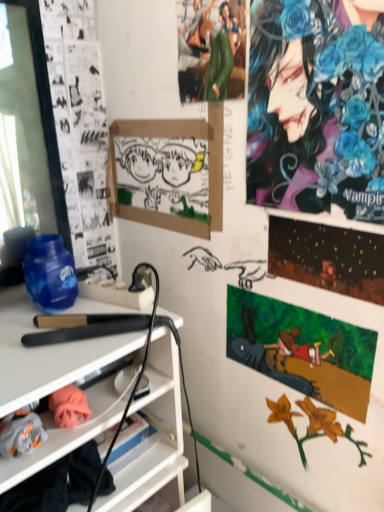
Question: In terms of size, does shiny metallic poster at upper right, which is the 2th poster page in bottom-to-top order, appear bigger or smaller than green fabric figure at upper center, the 1th person when ordered from left to right?

Choices:
 (A) big
 (B) small

Answer: (B)

Question: Is shiny metallic poster at upper right, which is the 2th poster page in bottom-to-top order, to the left or to the right of green fabric figure at upper center, the 1th person when ordered from left to right, in the image?

Choices:
 (A) left
 (B) right

Answer: (B)

Question: Estimate the real-world distances between objects in this image. Which object is farther from the shiny blue flowers at upper right, which appears as the 2th person when viewed from the left?

Choices:
 (A) watercolor paper painting at upper right, which appears as the first poster page when ordered from the bottom
 (B) green fabric figure at upper center, marked as the 2th person in a right-to-left arrangement
 (C) shiny metallic poster at upper right, which is the 2th poster page in bottom-to-top order
 (D) black matte hair straightener at center left
 (E) white paper drawing at center

Answer: (D)

Question: Which is nearer to the green fabric figure at upper center, marked as the 2th person in a right-to-left arrangement?

Choices:
 (A) black matte hair straightener at center left
 (B) shiny metallic poster at upper right, which is the 2th poster page in bottom-to-top order
 (C) shiny blue flowers at upper right, the first person from the right
 (D) white paper drawing at center
 (E) watercolor paper painting at upper right, arranged as the second poster page when viewed from the top

Answer: (C)